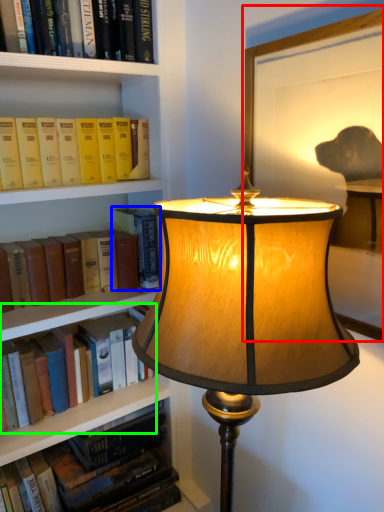
Question: Which object is positioned closest to picture frame (highlighted by a red box)? Select from book (highlighted by a blue box) and book (highlighted by a green box).

Choices:
 (A) book
 (B) book

Answer: (A)